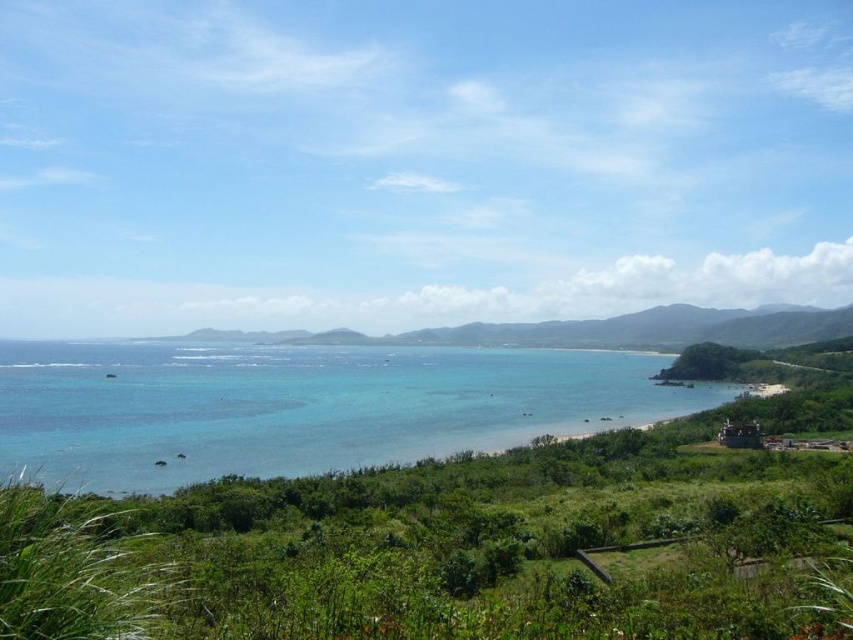
Question: Which is nearer to the green leafy vegetation at center?

Choices:
 (A) green grassy hillside at center
 (B) clear blue water at center

Answer: (B)

Question: Which point is farther to the camera?

Choices:
 (A) green leafy vegetation at center
 (B) green grassy hillside at center

Answer: (B)

Question: Can you confirm if clear blue water at center is positioned above green grassy hillside at center?

Choices:
 (A) yes
 (B) no

Answer: (B)

Question: Can you confirm if green leafy vegetation at center is bigger than green grassy hillside at center?

Choices:
 (A) yes
 (B) no

Answer: (B)

Question: Which is nearer to the clear blue water at center?

Choices:
 (A) green leafy vegetation at center
 (B) green grassy hillside at center

Answer: (B)

Question: Is green leafy vegetation at center positioned in front of green grassy hillside at center?

Choices:
 (A) yes
 (B) no

Answer: (A)